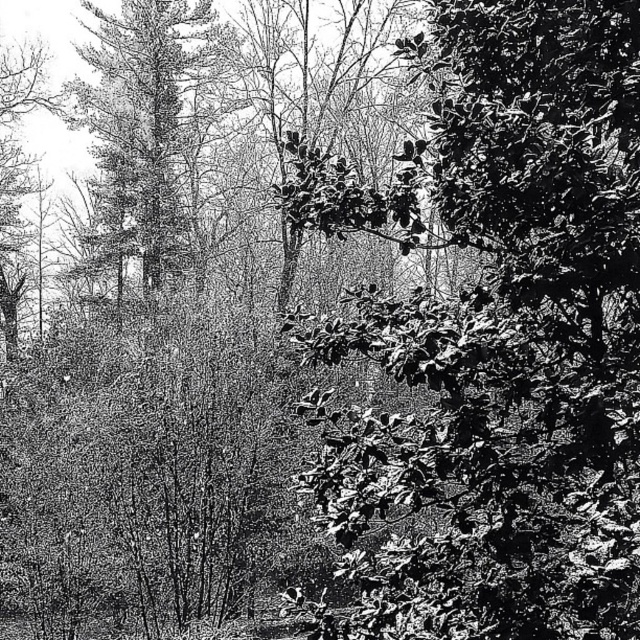
You are an ecologist studying the distribution of plants in this area. You notice the shiny green leaves at center and the smooth bark tree at left. Which object is located closer to the ground?

The shiny green leaves at center are closer to the ground because they are positioned under the smooth bark tree at left.

You are a photographer aiming to capture a closeup of both the shiny green leaves at center and the smooth bark tree at left without moving your camera position. Which object will appear larger in your photo?

The shiny green leaves at center will appear larger in the photo since they are closer to the viewer compared to the smooth bark tree at left.